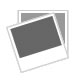
Identify the location of space below photos. The image size is (80, 80). (48, 75).